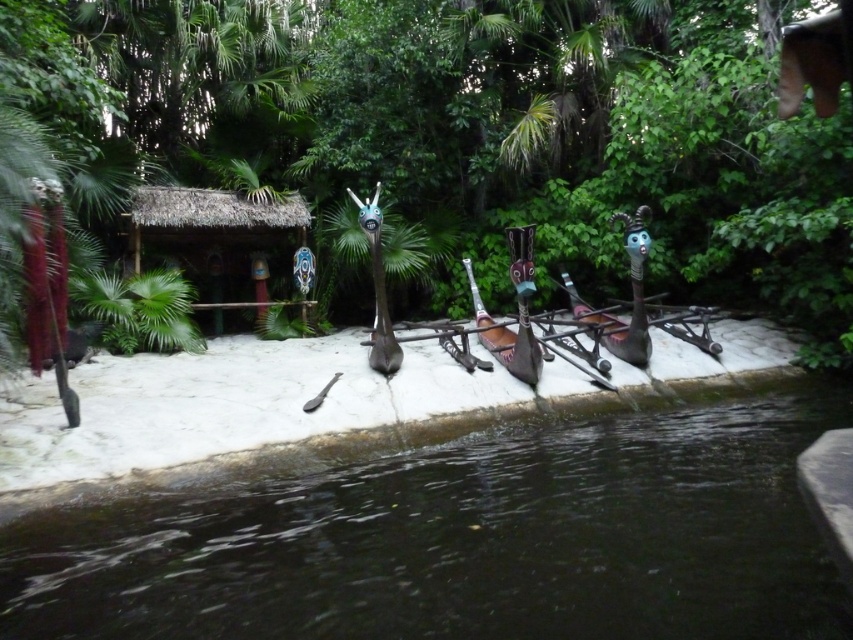
Between point (209, 554) and point (306, 317), which one is positioned in front?

Point (209, 554)

Is dark water at lower center smaller than thatched straw hut at center?

Yes.

Describe the element at coordinates (467, 540) in the screenshot. This screenshot has height=640, width=853. I see `dark water at lower center` at that location.

This screenshot has width=853, height=640. Identify the location of dark water at lower center. (467, 540).

Who is positioned more to the right, green leafy vegetation at center or dark water at lower center?

Positioned to the right is dark water at lower center.

Is point (264, 33) less distant than point (144, 518)?

No.

In order to click on green leafy vegetation at center in this screenshot , I will do `click(476, 129)`.

Is green leafy vegetation at center bigger than thatched straw hut at center?

Yes, green leafy vegetation at center is bigger than thatched straw hut at center.

Is green leafy vegetation at center taller than thatched straw hut at center?

Correct, green leafy vegetation at center is much taller as thatched straw hut at center.

Image resolution: width=853 pixels, height=640 pixels. Describe the element at coordinates (476, 129) in the screenshot. I see `green leafy vegetation at center` at that location.

Where is `green leafy vegetation at center`? green leafy vegetation at center is located at coordinates (476, 129).